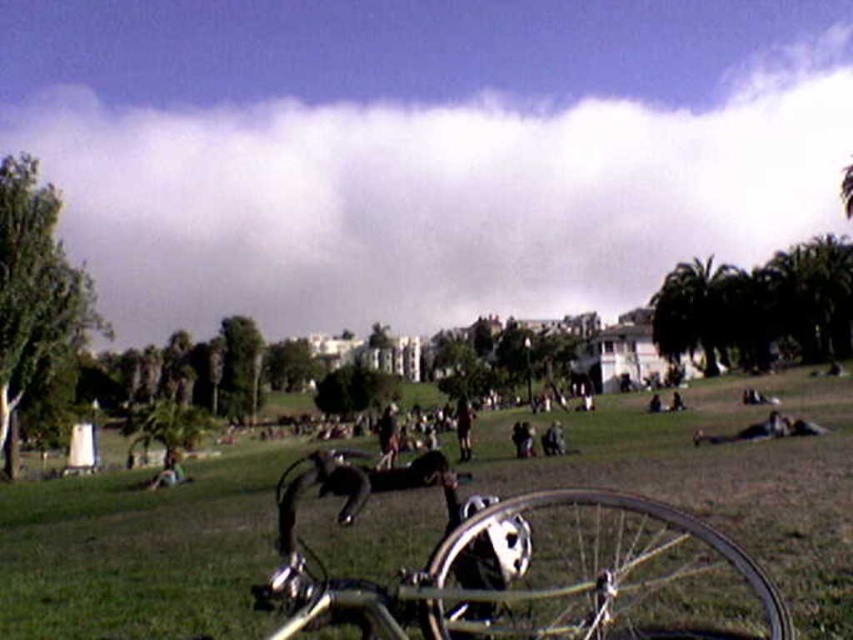
Question: Can you confirm if shiny metallic bicycle at center is wider than silver metallic bicycle at center?

Choices:
 (A) no
 (B) yes

Answer: (B)

Question: Is the position of shiny metallic bicycle at center less distant than that of silver metallic bicycle at center?

Choices:
 (A) yes
 (B) no

Answer: (B)

Question: Can you confirm if shiny metallic bicycle at center is bigger than silver metallic bicycle at center?

Choices:
 (A) yes
 (B) no

Answer: (A)

Question: Which point appears closest to the camera in this image?

Choices:
 (A) pos(642,595)
 (B) pos(717,477)

Answer: (A)